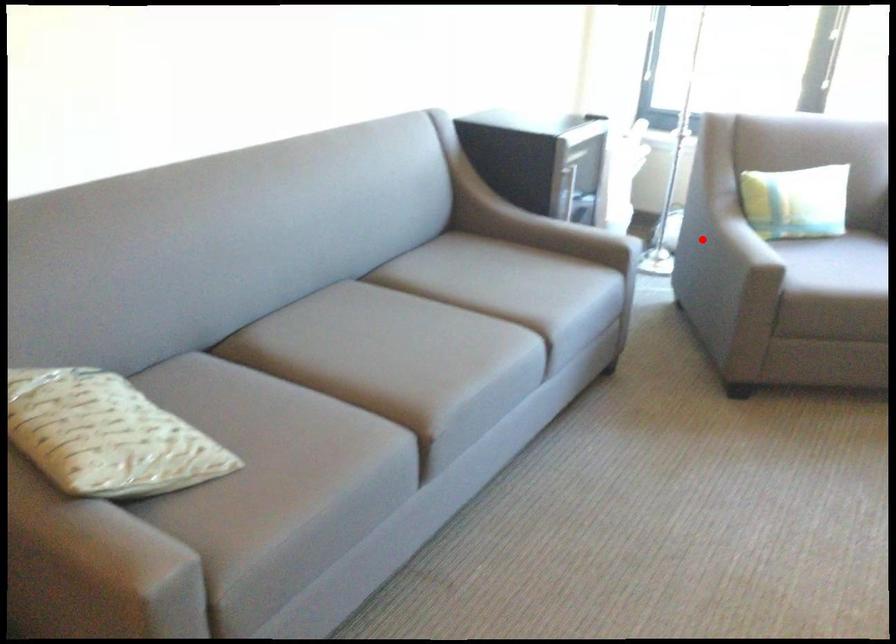
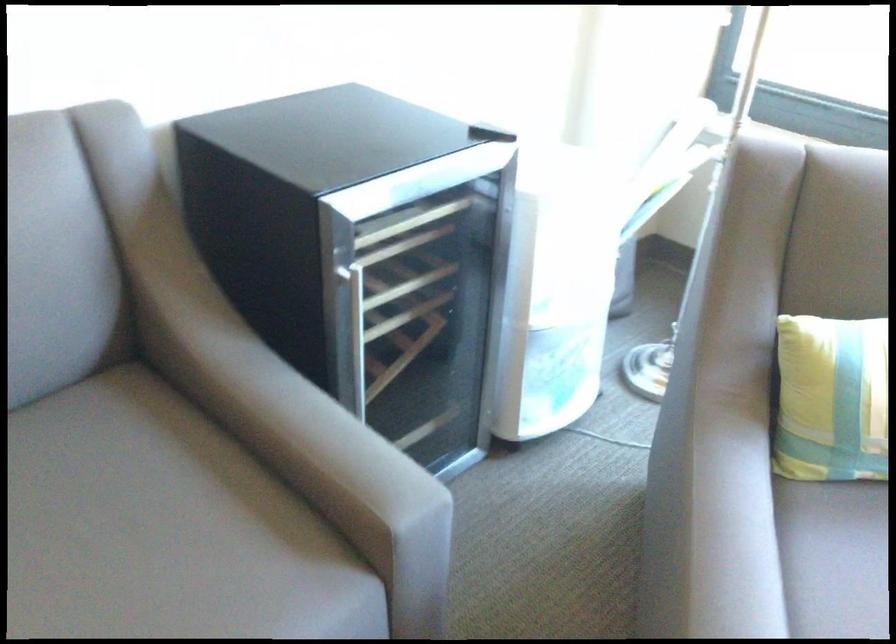
Locate, in the second image, the point that corresponds to the highlighted location in the first image.

(711, 522)